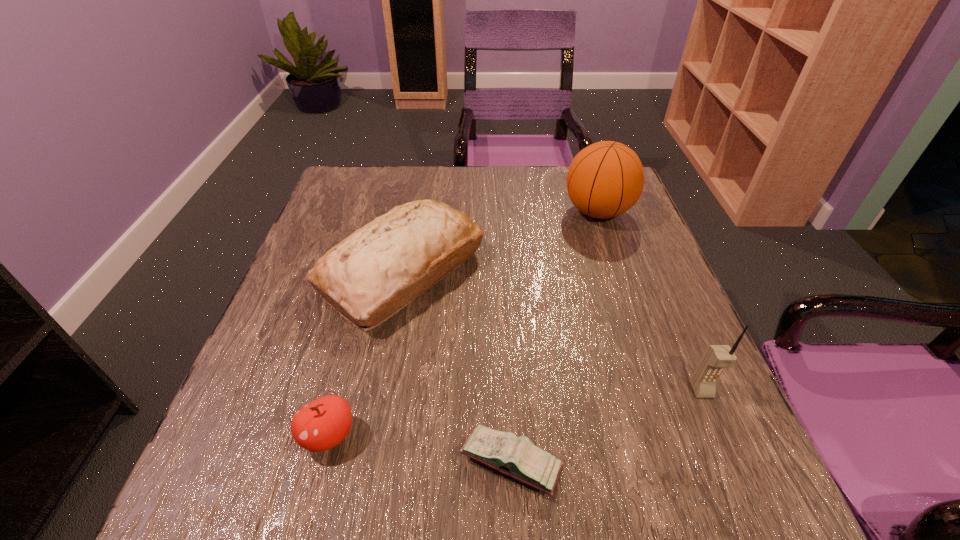
Find the location of `empty location between the third nearest object and the second shortest object`. empty location between the third nearest object and the second shortest object is located at coordinates (516, 413).

Choose which object is the fourth nearest neighbor to the third nearest object. Please provide its 2D coordinates. Your answer should be formatted as a tuple, i.e. [(x, y)], where the tuple contains the x and y coordinates of a point satisfying the conditions above.

[(322, 424)]

Select which object is the third closest to the bread. Please provide its 2D coordinates. Your answer should be formatted as a tuple, i.e. [(x, y)], where the tuple contains the x and y coordinates of a point satisfying the conditions above.

[(605, 179)]